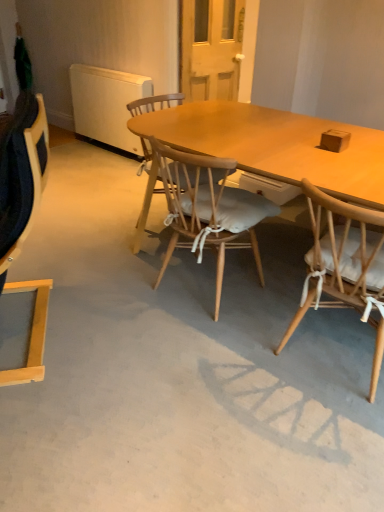
This screenshot has height=512, width=384. Find the location of `free area below light wood chair at left, placed as the first chair when sorted from left to right (from a real-world perspective)`. free area below light wood chair at left, placed as the first chair when sorted from left to right (from a real-world perspective) is located at coordinates (47, 332).